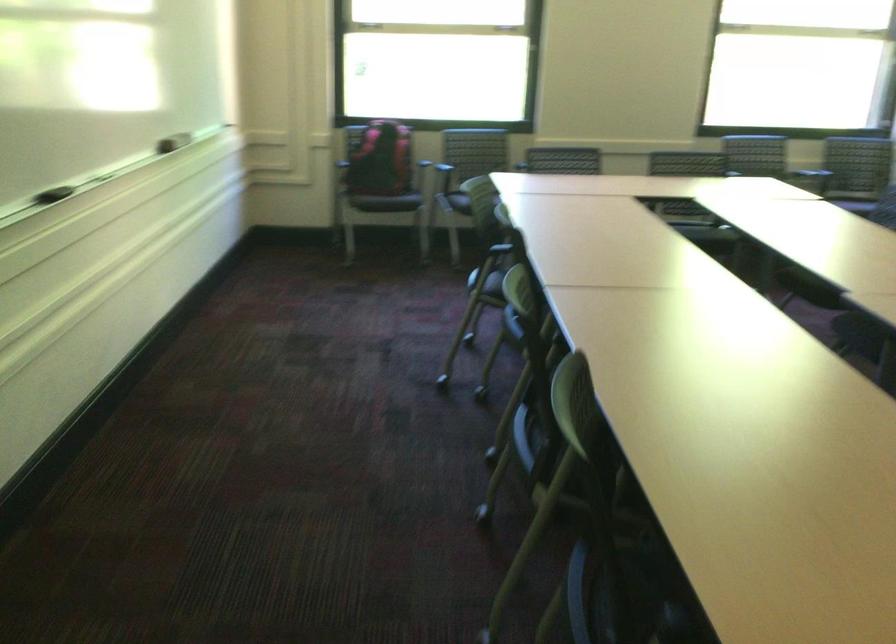
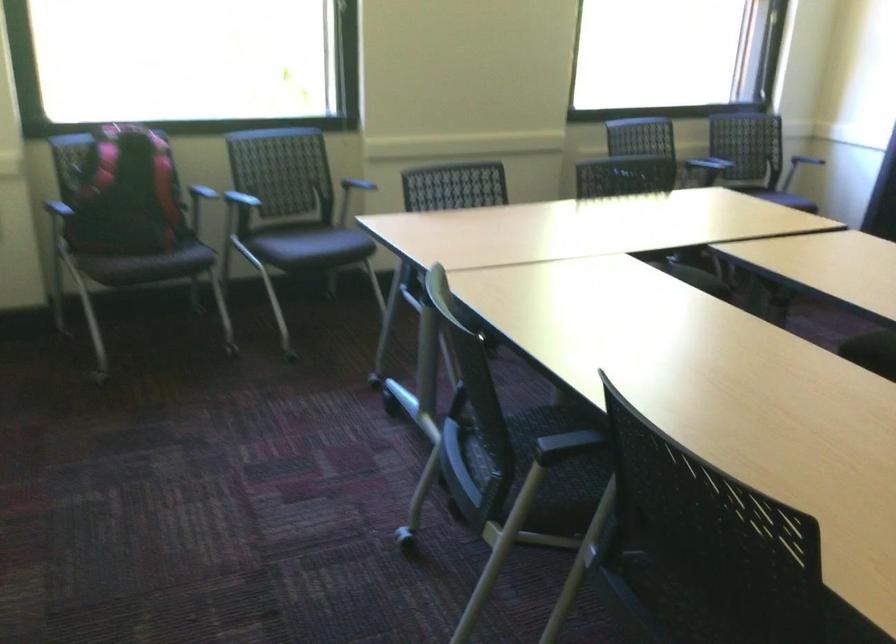
Find the pixel in the second image that matches pixel 326 155 in the first image.

(42, 211)